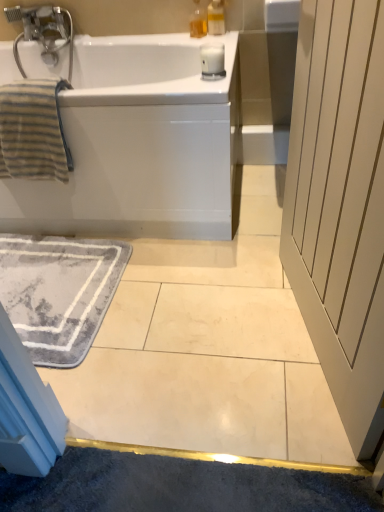
This screenshot has width=384, height=512. Describe the element at coordinates (340, 204) in the screenshot. I see `white wood screen door at right` at that location.

In order to face translucent plastic soap dispenser at upper center, which is counted as the second soap dispenser, starting from the left, should I rotate leftwards or rightwards?

You should look right and rotate roughly 3.488 degrees.

Where is `white glossy bathtub at upper left`? The image size is (384, 512). white glossy bathtub at upper left is located at coordinates (140, 144).

Describe the element at coordinates (59, 292) in the screenshot. I see `gray soft rug at lower left` at that location.

The image size is (384, 512). Describe the element at coordinates (198, 21) in the screenshot. I see `translucent plastic soap dispenser at upper center, the 1th soap dispenser viewed from the left` at that location.

Identify the location of white wood screen door at right. The image size is (384, 512). (340, 204).

Find the location of `the 1st soap dispenser behind the striped cotton towel at left, starting your count from the anchor`. the 1st soap dispenser behind the striped cotton towel at left, starting your count from the anchor is located at coordinates (216, 17).

Is striped cotton towel at left oriented towards translucent plastic soap dispenser at upper center, which is counted as the second soap dispenser, starting from the left?

No, striped cotton towel at left is not facing towards translucent plastic soap dispenser at upper center, which is counted as the second soap dispenser, starting from the left.

From a real-world perspective, is striped cotton towel at left on translucent plastic soap dispenser at upper center, which is counted as the second soap dispenser, starting from the left?

No, from a real-world perspective, striped cotton towel at left is not over translucent plastic soap dispenser at upper center, which is counted as the second soap dispenser, starting from the left

Is striped cotton towel at left taller than translucent plastic soap dispenser at upper center, which is counted as the second soap dispenser, starting from the left?

Yes, striped cotton towel at left is taller than translucent plastic soap dispenser at upper center, which is counted as the second soap dispenser, starting from the left.

From the image's perspective, between white wood screen door at right and gray soft rug at lower left, who is located below?

gray soft rug at lower left is shown below in the image.

Does white wood screen door at right turn towards gray soft rug at lower left?

Yes, white wood screen door at right is turned towards gray soft rug at lower left.

Are white wood screen door at right and gray soft rug at lower left making contact?

No, white wood screen door at right is not in contact with gray soft rug at lower left.

Based on the photo, is gray soft rug at lower left located within white wood screen door at right?

No, gray soft rug at lower left is not inside white wood screen door at right.

Which object is positioned more to the left, gray soft rug at lower left or translucent plastic soap dispenser at upper center, which is counted as the 2th soap dispenser, starting from the right?

From the viewer's perspective, gray soft rug at lower left appears more on the left side.

Does gray soft rug at lower left have a greater height compared to translucent plastic soap dispenser at upper center, which is counted as the 2th soap dispenser, starting from the right?

No, gray soft rug at lower left is not taller than translucent plastic soap dispenser at upper center, which is counted as the 2th soap dispenser, starting from the right.

From the image's perspective, relative to translucent plastic soap dispenser at upper center, which is counted as the 2th soap dispenser, starting from the right, is gray soft rug at lower left above or below?

Based on their image positions, gray soft rug at lower left is located beneath translucent plastic soap dispenser at upper center, which is counted as the 2th soap dispenser, starting from the right.

In terms of width, does gray soft rug at lower left look wider or thinner when compared to translucent plastic soap dispenser at upper center, which is counted as the 2th soap dispenser, starting from the right?

gray soft rug at lower left is wider than translucent plastic soap dispenser at upper center, which is counted as the 2th soap dispenser, starting from the right.

Is striped cotton towel at left to the right of white wood screen door at right from the viewer's perspective?

Incorrect, striped cotton towel at left is not on the right side of white wood screen door at right.

The image size is (384, 512). I want to click on bath towel on the left of white wood screen door at right, so click(x=33, y=131).

In the image, is striped cotton towel at left positioned in front of or behind white wood screen door at right?

Visually, striped cotton towel at left is located behind white wood screen door at right.

Is point (197, 27) behind point (223, 13)?

That is False.

Considering the relative positions of translucent plastic soap dispenser at upper center, which is counted as the 2th soap dispenser, starting from the right, and translucent plastic soap dispenser at upper center, the 1th soap dispenser from the right, in the image provided, is translucent plastic soap dispenser at upper center, which is counted as the 2th soap dispenser, starting from the right, to the left or to the right of translucent plastic soap dispenser at upper center, the 1th soap dispenser from the right,?

From the image, it's evident that translucent plastic soap dispenser at upper center, which is counted as the 2th soap dispenser, starting from the right, is to the left of translucent plastic soap dispenser at upper center, the 1th soap dispenser from the right.

Considering the sizes of objects translucent plastic soap dispenser at upper center, which is counted as the 2th soap dispenser, starting from the right, and translucent plastic soap dispenser at upper center, which is counted as the second soap dispenser, starting from the left, in the image provided, who is thinner, translucent plastic soap dispenser at upper center, which is counted as the 2th soap dispenser, starting from the right, or translucent plastic soap dispenser at upper center, which is counted as the second soap dispenser, starting from the left,?

Thinner between the two is translucent plastic soap dispenser at upper center, which is counted as the 2th soap dispenser, starting from the right.

From a real-world perspective, which is physically above, translucent plastic soap dispenser at upper center, the 1th soap dispenser viewed from the left, or translucent plastic soap dispenser at upper center, which is counted as the second soap dispenser, starting from the left?

translucent plastic soap dispenser at upper center, which is counted as the second soap dispenser, starting from the left, is physically above.

Is translucent plastic soap dispenser at upper center, which is counted as the second soap dispenser, starting from the left, bigger than white wood screen door at right?

Actually, translucent plastic soap dispenser at upper center, which is counted as the second soap dispenser, starting from the left, might be smaller than white wood screen door at right.

Between translucent plastic soap dispenser at upper center, which is counted as the second soap dispenser, starting from the left, and white wood screen door at right, which one appears on the left side from the viewer's perspective?

Positioned to the left is translucent plastic soap dispenser at upper center, which is counted as the second soap dispenser, starting from the left.

Which is correct: translucent plastic soap dispenser at upper center, the 1th soap dispenser from the right, is inside white wood screen door at right, or outside of it?

translucent plastic soap dispenser at upper center, the 1th soap dispenser from the right, is outside white wood screen door at right.

Is translucent plastic soap dispenser at upper center, which is counted as the 2th soap dispenser, starting from the right, at the back of translucent plastic soap dispenser at upper center, the 1th soap dispenser from the right?

No.

Is translucent plastic soap dispenser at upper center, which is counted as the second soap dispenser, starting from the left, to the right of translucent plastic soap dispenser at upper center, the 1th soap dispenser viewed from the left, from the viewer's perspective?

Yes, translucent plastic soap dispenser at upper center, which is counted as the second soap dispenser, starting from the left, is to the right of translucent plastic soap dispenser at upper center, the 1th soap dispenser viewed from the left.

Considering the relative sizes of translucent plastic soap dispenser at upper center, which is counted as the second soap dispenser, starting from the left, and translucent plastic soap dispenser at upper center, which is counted as the 2th soap dispenser, starting from the right, in the image provided, is translucent plastic soap dispenser at upper center, which is counted as the second soap dispenser, starting from the left, shorter than translucent plastic soap dispenser at upper center, which is counted as the 2th soap dispenser, starting from the right,?

No, translucent plastic soap dispenser at upper center, which is counted as the second soap dispenser, starting from the left, is not shorter than translucent plastic soap dispenser at upper center, which is counted as the 2th soap dispenser, starting from the right.

This screenshot has height=512, width=384. I want to click on the 2nd soap dispenser positioned above the striped cotton towel at left (from the image's perspective), so click(x=216, y=17).

Where is `screen door on the right side of gray soft rug at lower left`? screen door on the right side of gray soft rug at lower left is located at coordinates (340, 204).

From the image, which object appears to be nearer to white glossy bathtub at upper left, striped cotton towel at left or gray soft rug at lower left?

striped cotton towel at left is positioned closer to the anchor white glossy bathtub at upper left.

Based on their spatial positions, is gray soft rug at lower left or white wood screen door at right further from white glossy bathtub at upper left?

white wood screen door at right lies further to white glossy bathtub at upper left than the other object.

Which object lies nearer to the anchor point gray soft rug at lower left, white glossy bathtub at upper left or white wood screen door at right?

The object closer to gray soft rug at lower left is white glossy bathtub at upper left.

Looking at the image, which one is located closer to white wood screen door at right, striped cotton towel at left or translucent plastic soap dispenser at upper center, the 1th soap dispenser from the right?

translucent plastic soap dispenser at upper center, the 1th soap dispenser from the right.

From the image, which object appears to be nearer to white wood screen door at right, translucent plastic soap dispenser at upper center, which is counted as the second soap dispenser, starting from the left, or white glossy bathtub at upper left?

white glossy bathtub at upper left lies closer to white wood screen door at right than the other object.

From the image, which object appears to be nearer to striped cotton towel at left, translucent plastic soap dispenser at upper center, the 1th soap dispenser from the right, or gray soft rug at lower left?

gray soft rug at lower left lies closer to striped cotton towel at left than the other object.

Consider the image. Estimate the real-world distances between objects in this image. Which object is closer to translucent plastic soap dispenser at upper center, the 1th soap dispenser from the right, white wood screen door at right or striped cotton towel at left?

Among the two, striped cotton towel at left is located nearer to translucent plastic soap dispenser at upper center, the 1th soap dispenser from the right.

Considering their positions, is striped cotton towel at left positioned further to translucent plastic soap dispenser at upper center, the 1th soap dispenser from the right, than white glossy bathtub at upper left?

striped cotton towel at left is further to translucent plastic soap dispenser at upper center, the 1th soap dispenser from the right.

Where is `bathtub between white wood screen door at right and translucent plastic soap dispenser at upper center, which is counted as the second soap dispenser, starting from the left, from front to back`? The image size is (384, 512). bathtub between white wood screen door at right and translucent plastic soap dispenser at upper center, which is counted as the second soap dispenser, starting from the left, from front to back is located at coordinates (140, 144).

Find the location of a particular element. The image size is (384, 512). soap dispenser between translucent plastic soap dispenser at upper center, the 1th soap dispenser from the right, and gray soft rug at lower left vertically is located at coordinates (198, 21).

Find the location of a particular element. This screenshot has width=384, height=512. bathtub situated between striped cotton towel at left and translucent plastic soap dispenser at upper center, the 1th soap dispenser viewed from the left, from left to right is located at coordinates (140, 144).

In order to click on soap dispenser located between white wood screen door at right and translucent plastic soap dispenser at upper center, which is counted as the 2th soap dispenser, starting from the right, in the depth direction in this screenshot , I will do `click(216, 17)`.